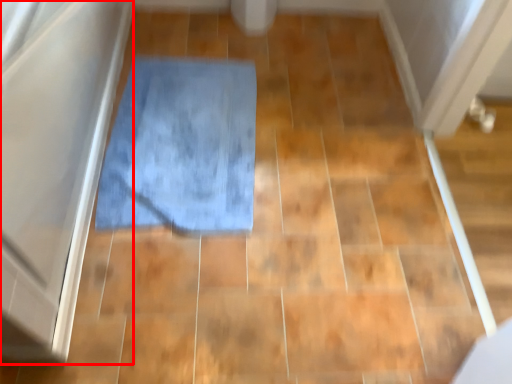
Question: From the image's perspective, considering the relative positions of screen door (annotated by the red box) and bath mat in the image provided, where is screen door (annotated by the red box) located with respect to the staircase?

Choices:
 (A) above
 (B) below

Answer: (A)